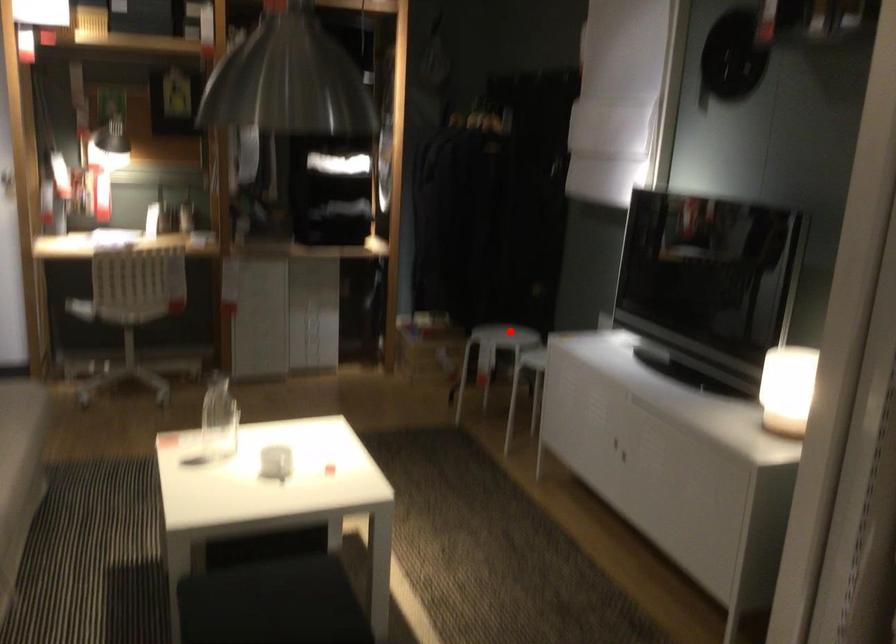
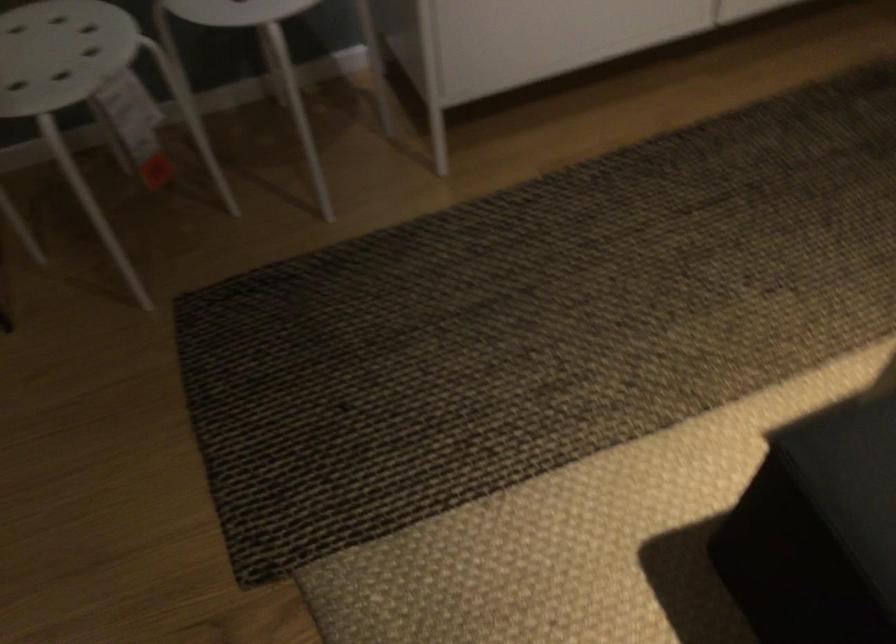
Where in the second image is the point corresponding to the highlighted location from the first image?

(61, 53)